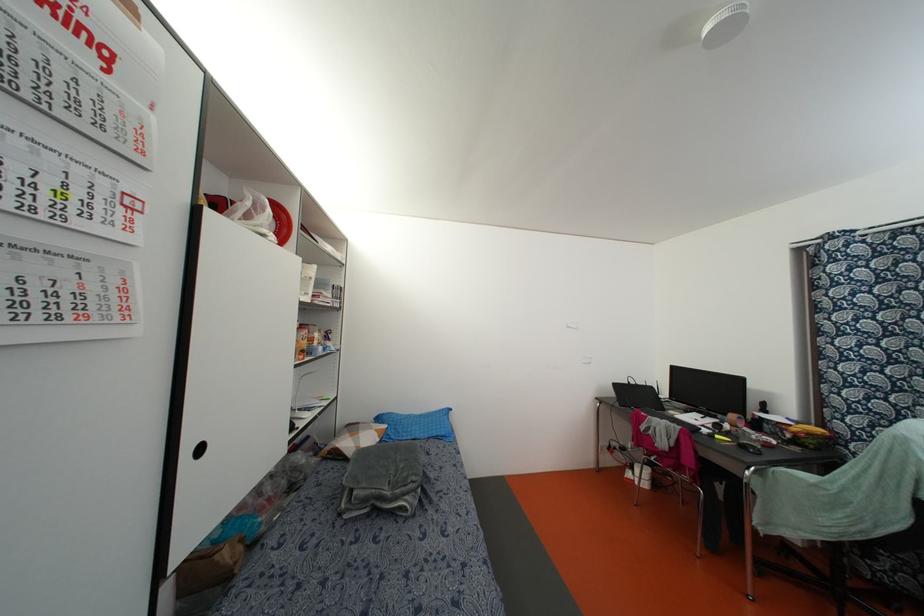
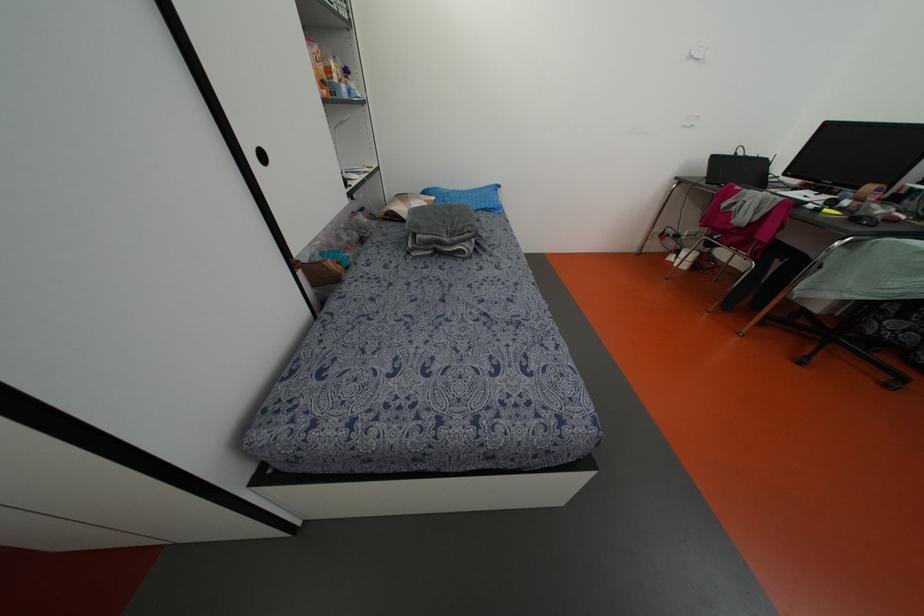
Where in the second image is the point corresponding to (x=631, y=382) from the first image?

(739, 153)